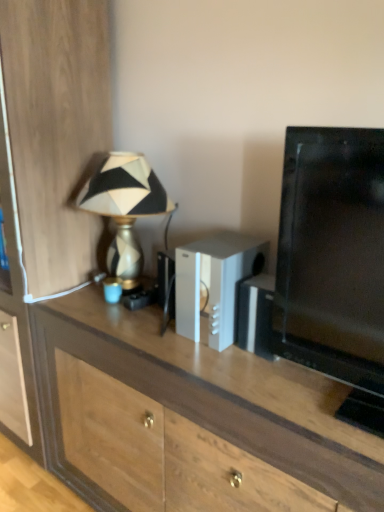
Question: Is wooden desk at center in contact with silver metallic speaker at center?

Choices:
 (A) yes
 (B) no

Answer: (B)

Question: Does wooden desk at center have a greater width compared to silver metallic speaker at center?

Choices:
 (A) no
 (B) yes

Answer: (B)

Question: Is wooden desk at center looking in the opposite direction of silver metallic speaker at center?

Choices:
 (A) no
 (B) yes

Answer: (A)

Question: Can you confirm if wooden desk at center is thinner than silver metallic speaker at center?

Choices:
 (A) no
 (B) yes

Answer: (A)

Question: Does wooden desk at center contain silver metallic speaker at center?

Choices:
 (A) yes
 (B) no

Answer: (B)

Question: Could you tell me if wooden desk at center is turned towards silver metallic speaker at center?

Choices:
 (A) no
 (B) yes

Answer: (A)

Question: Is silver metallic speaker at center closer to camera compared to wooden desk at center?

Choices:
 (A) yes
 (B) no

Answer: (B)

Question: Are silver metallic speaker at center and wooden desk at center making contact?

Choices:
 (A) no
 (B) yes

Answer: (A)

Question: Can you confirm if silver metallic speaker at center is shorter than wooden desk at center?

Choices:
 (A) yes
 (B) no

Answer: (A)

Question: From the image's perspective, would you say silver metallic speaker at center is shown under wooden desk at center?

Choices:
 (A) yes
 (B) no

Answer: (B)

Question: Can you confirm if silver metallic speaker at center is taller than wooden desk at center?

Choices:
 (A) no
 (B) yes

Answer: (A)

Question: Does silver metallic speaker at center have a smaller size compared to wooden desk at center?

Choices:
 (A) yes
 (B) no

Answer: (A)

Question: From a real-world perspective, is gold textured lamp at left physically above wooden cabinet at left?

Choices:
 (A) no
 (B) yes

Answer: (B)